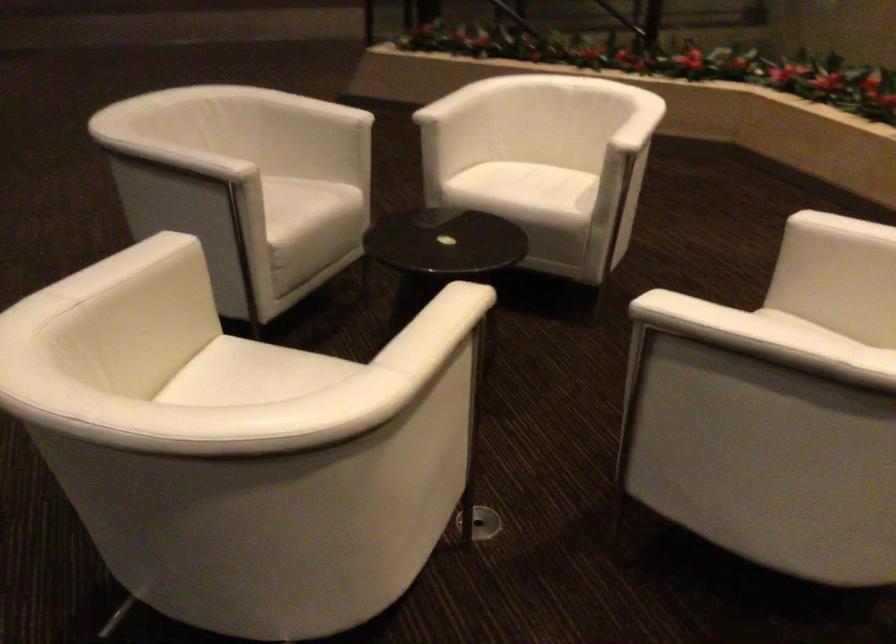
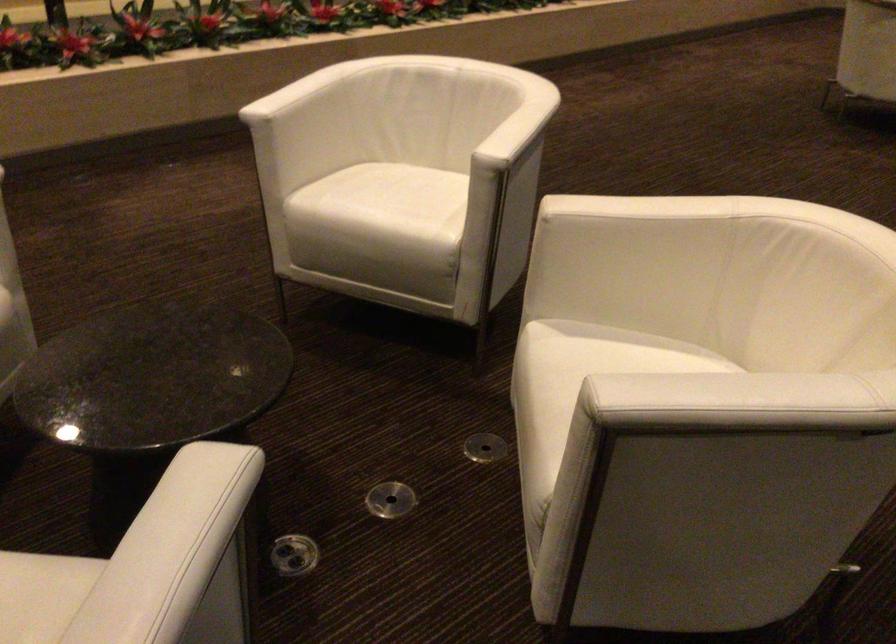
Locate, in the second image, the point that corresponds to [478,524] in the first image.

(484, 447)